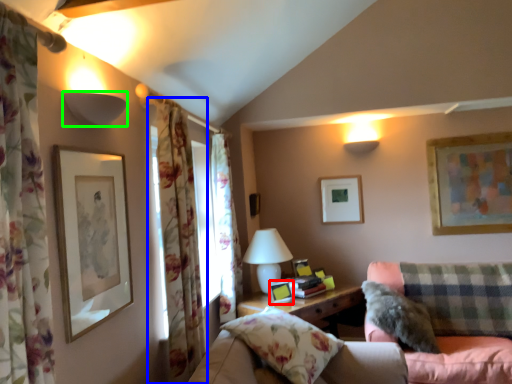
Question: Considering the real-world distances, which object is farthest from picture frame (highlighted by a red box)? curtain (highlighted by a blue box) or lamp (highlighted by a green box)?

Choices:
 (A) curtain
 (B) lamp

Answer: (B)